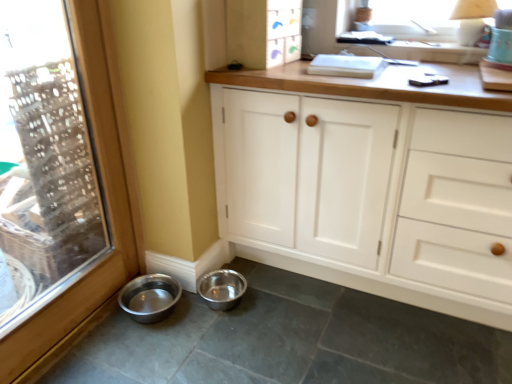
Find the location of `free space in front of metallic silver bowl at lower left, the 2th basin viewed from the right`. free space in front of metallic silver bowl at lower left, the 2th basin viewed from the right is located at coordinates coord(141,341).